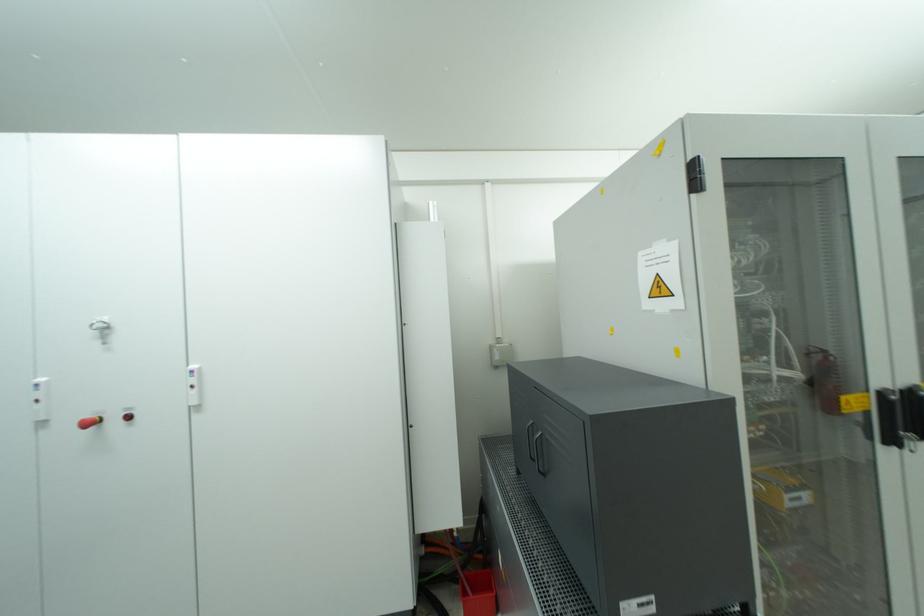
What do you see at coordinates (900, 415) in the screenshot?
I see `the black door handle` at bounding box center [900, 415].